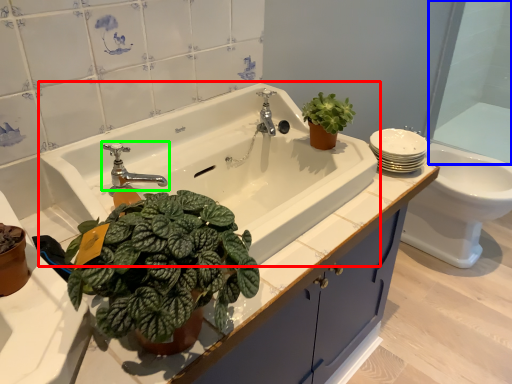
Question: Based on their relative distances, which object is nearer to sink (highlighted by a red box)? Choose from glass door (highlighted by a blue box) and tap (highlighted by a green box).

Choices:
 (A) glass door
 (B) tap

Answer: (B)